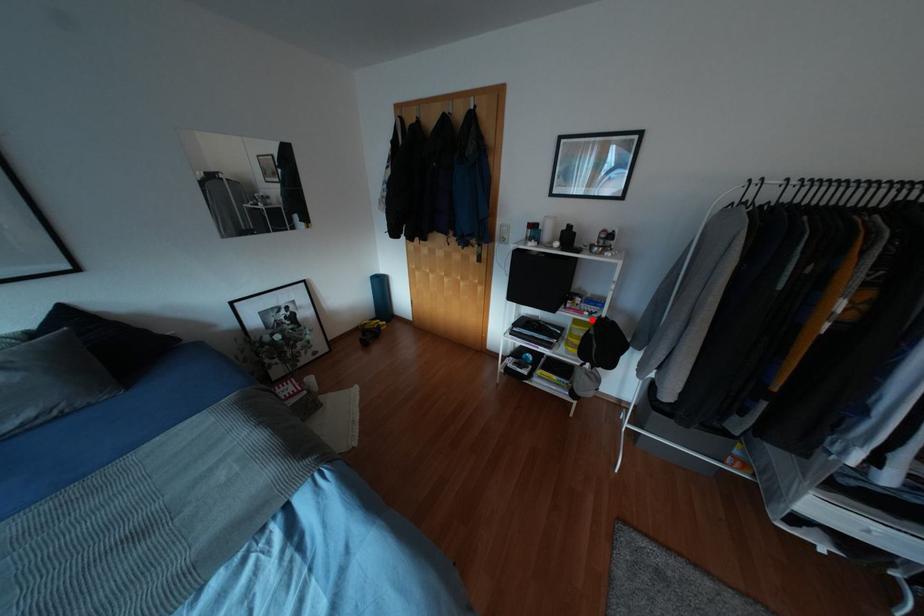
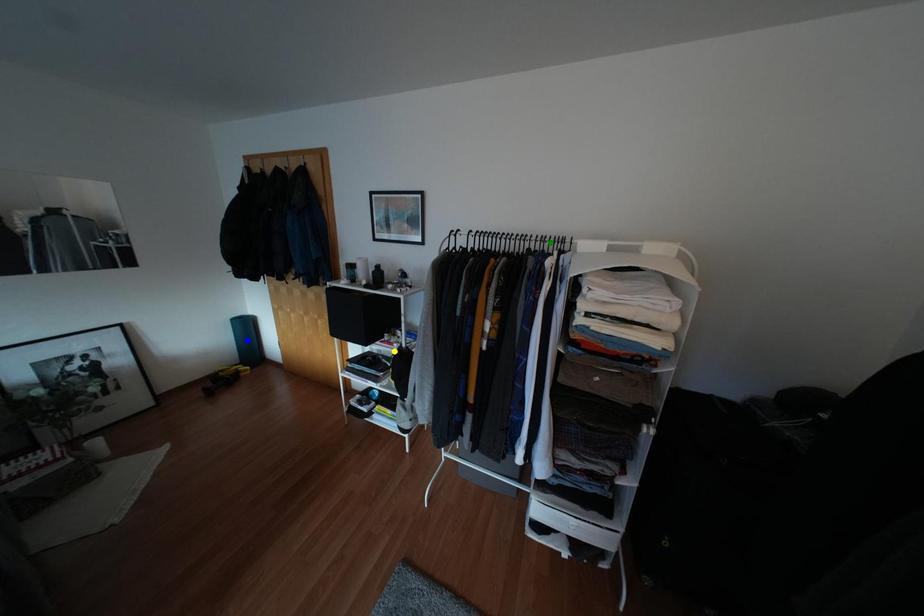
Question: I am providing you with two images of the same scene from different viewpoints. A red point is marked on the first image. You are given multiple points on the second image. Which point in image 2 represents the same 3d spot as the red point in image 1?

Choices:
 (A) blue point
 (B) yellow point
 (C) green point

Answer: (B)